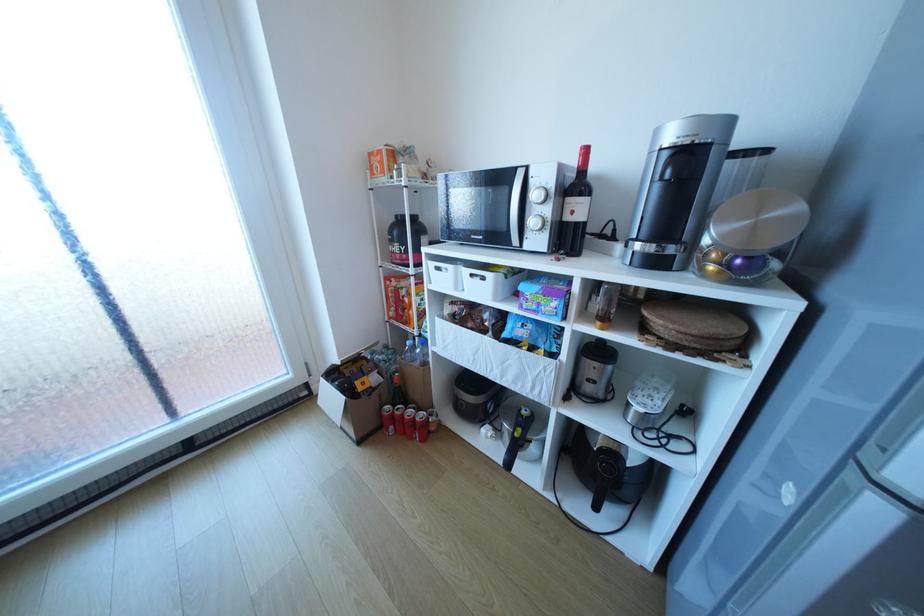
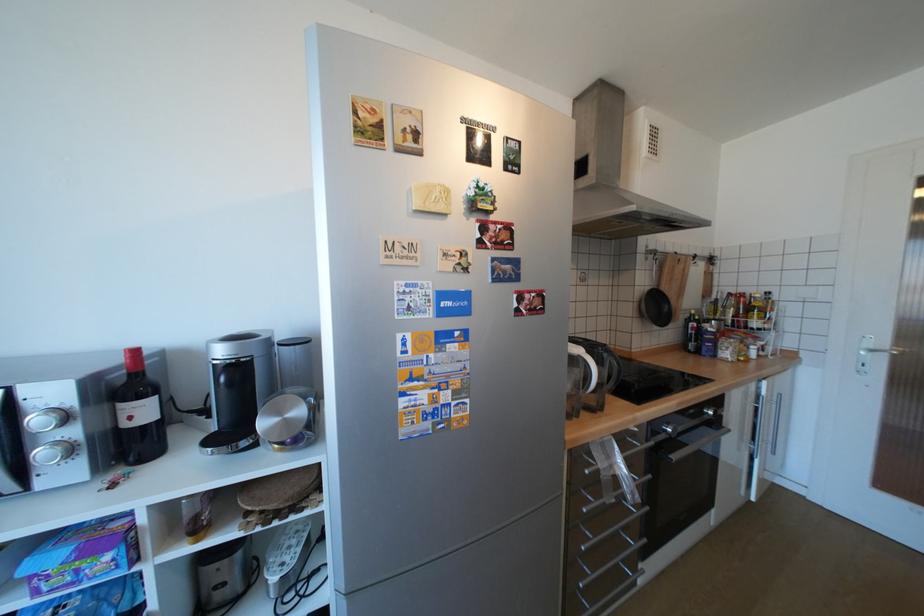
Where in the second image is the point corresponding to [720,267] from the first image?

(286, 446)